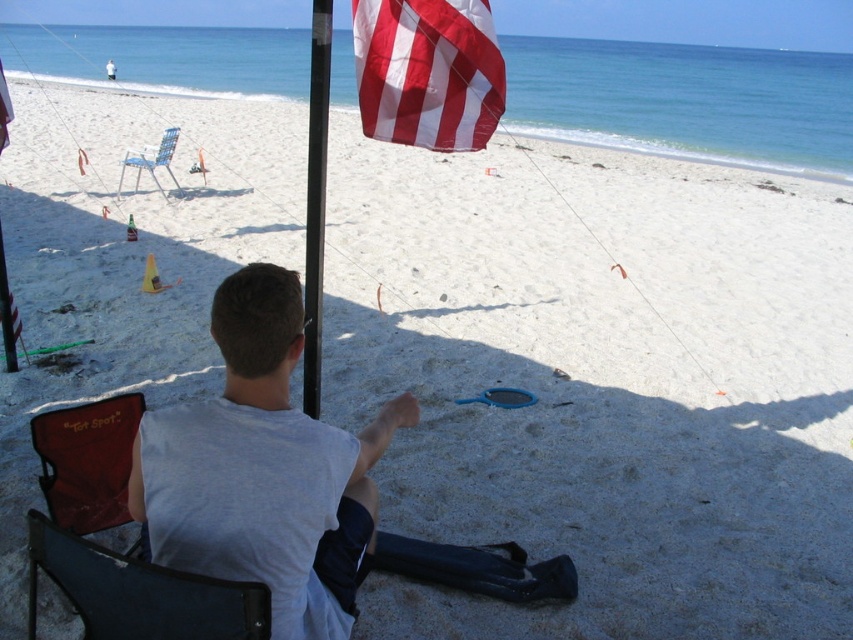
Question: Is maroon fabric chair at lower left to the right of metallic blue chair at upper left from the viewer's perspective?

Choices:
 (A) yes
 (B) no

Answer: (A)

Question: Which of the following is the farthest from the observer?

Choices:
 (A) maroon fabric chair at lower left
 (B) black matte flag pole at center

Answer: (B)

Question: Which of the following is the farthest from the observer?

Choices:
 (A) (53, 436)
 (B) (136, 156)
 (C) (399, 42)

Answer: (B)

Question: Does dark gray fabric chair at lower left have a lesser width compared to maroon fabric chair at lower left?

Choices:
 (A) no
 (B) yes

Answer: (A)

Question: Does white cotton shirt at center appear on the right side of metallic blue chair at upper left?

Choices:
 (A) no
 (B) yes

Answer: (B)

Question: Which point appears closest to the camera in this image?

Choices:
 (A) (466, 17)
 (B) (138, 179)
 (C) (279, 595)
 (D) (312, 8)

Answer: (C)